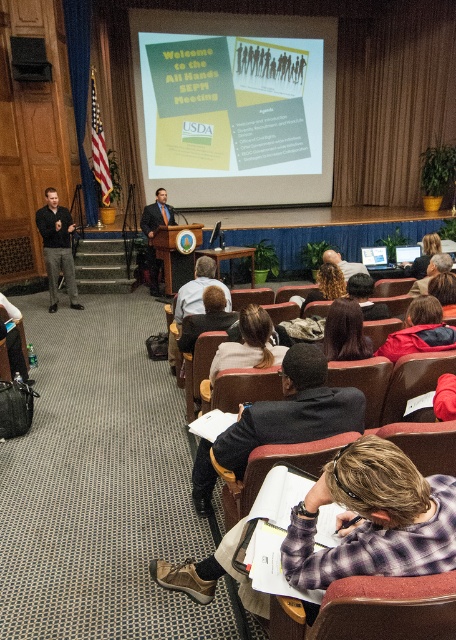
You are an attendee sitting in the back row of the conference room. You notice the green matte projection screen at upper center and the dark brown hair at center. Which object is taller?

The green matte projection screen at upper center is taller than the dark brown hair at center according to the description.

You are an attendee sitting in the back row of the conference room. You notice the green matte projection screen at upper center and the dark brown hair at center. Which object is positioned higher in the image?

The green matte projection screen at upper center is positioned higher than the dark brown hair at center.